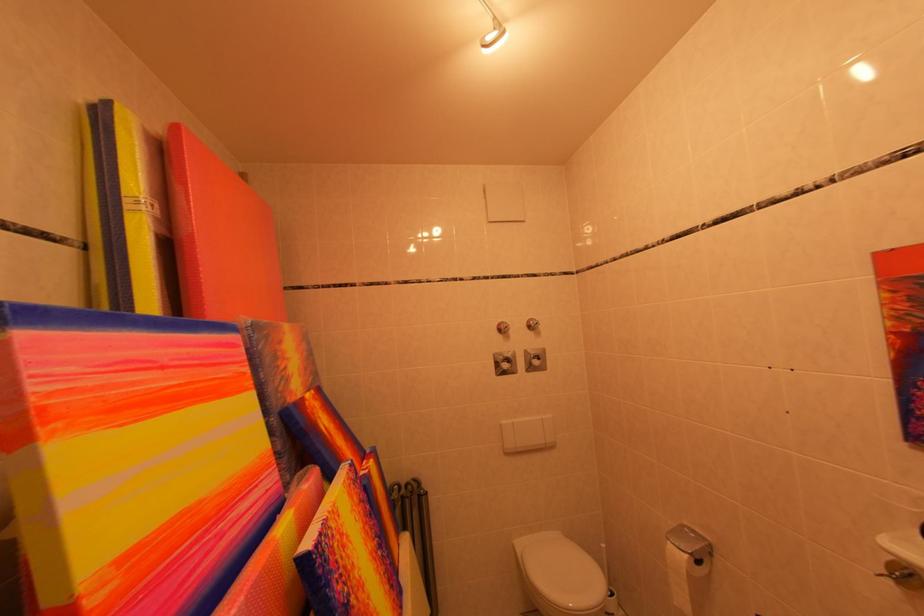
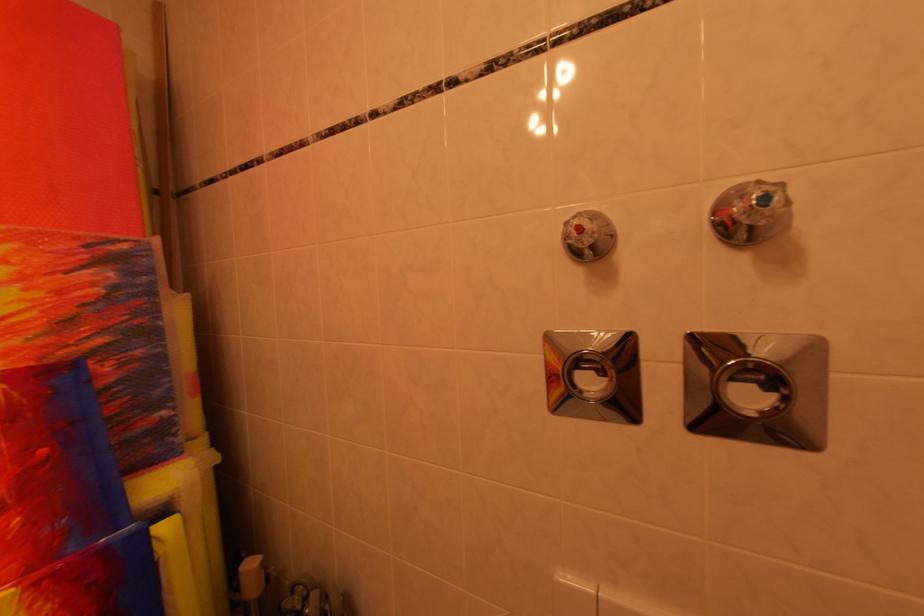
Locate, in the second image, the point that corresponds to (545,328) in the first image.

(773, 201)